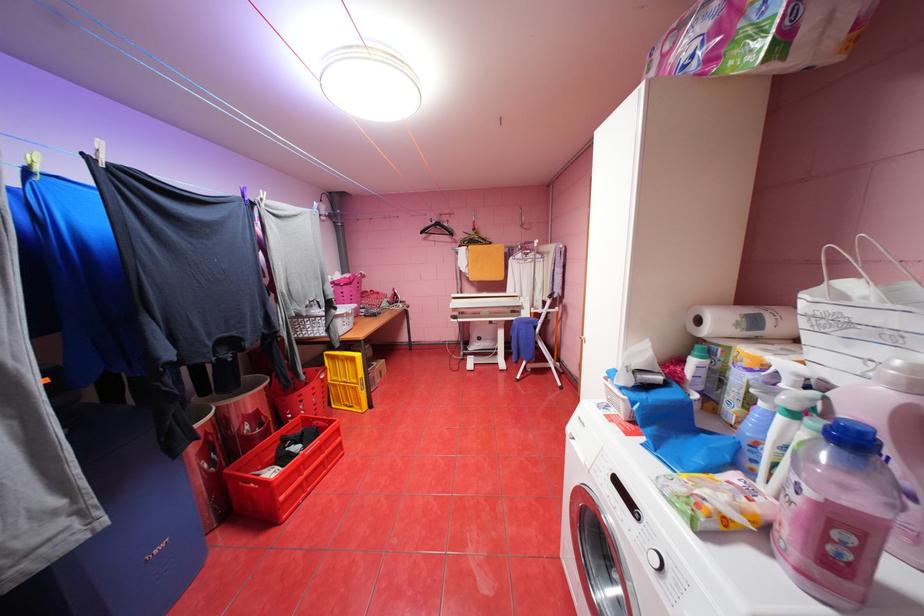
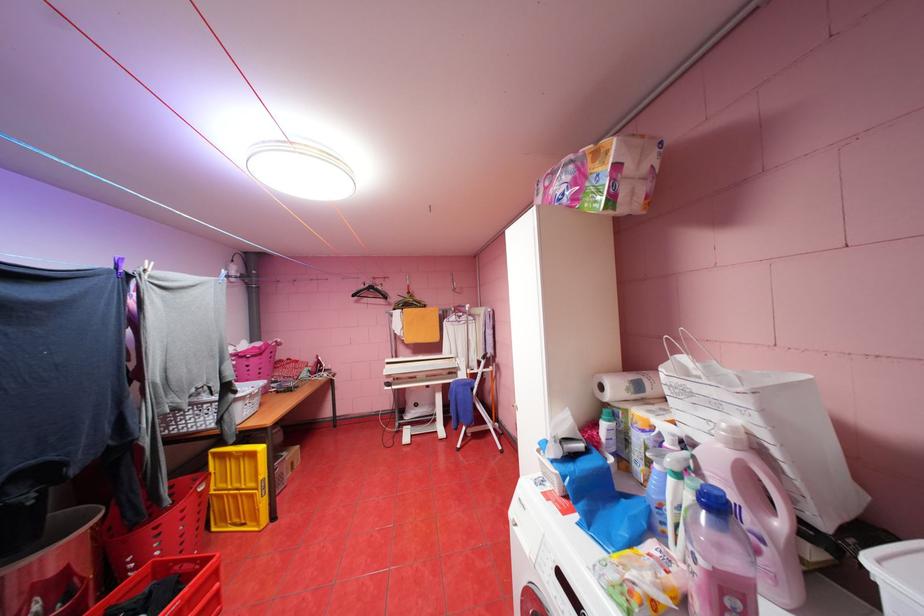
Locate, in the second image, the point that corresponds to [854,453] in the first image.

(723, 517)